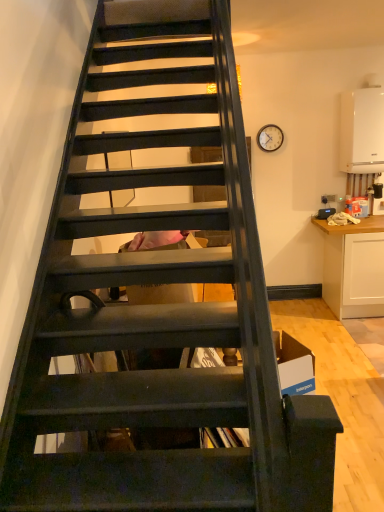
Question: Choose the correct answer: Is white matte cabinet at right inside white matte boiler at upper right or outside it?

Choices:
 (A) inside
 (B) outside

Answer: (B)

Question: From their relative heights in the image, would you say white matte cabinet at right is taller or shorter than white matte boiler at upper right?

Choices:
 (A) short
 (B) tall

Answer: (B)

Question: Considering the real-world distances, which object is closest to the white matte cabinet at right?

Choices:
 (A) white matte boiler at upper right
 (B) matte brown clock at upper right

Answer: (A)

Question: Which is nearer to the white matte boiler at upper right?

Choices:
 (A) matte brown clock at upper right
 (B) white matte cabinet at right

Answer: (A)